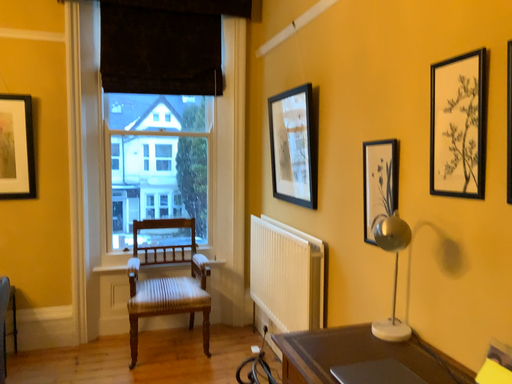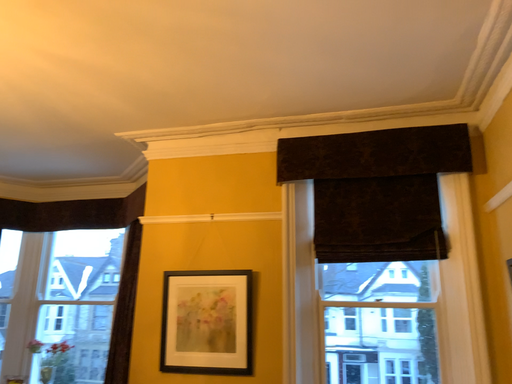
Question: Which way did the camera rotate in the video?

Choices:
 (A) rotated left
 (B) rotated right

Answer: (A)